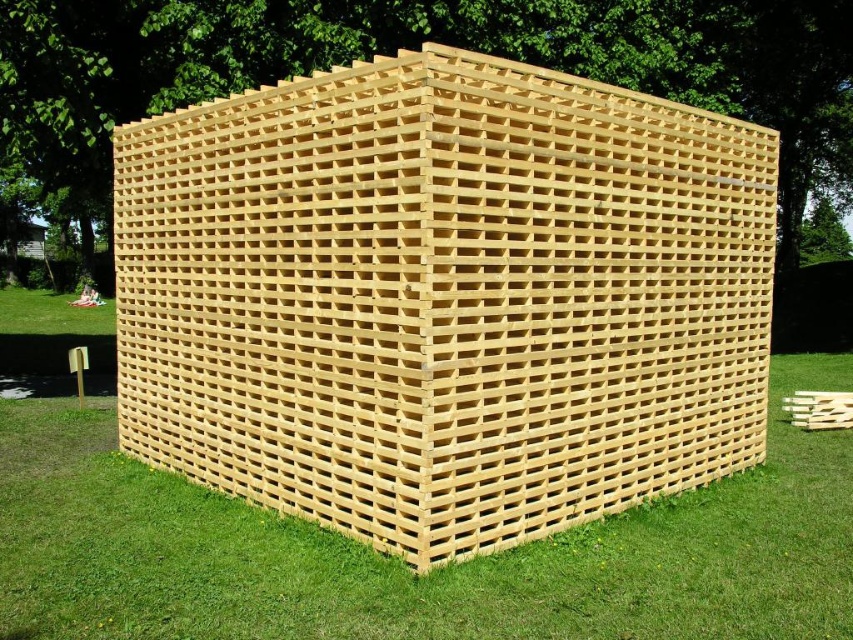
Between point (334, 397) and point (683, 586), which one is positioned in front?

Point (683, 586) is more forward.

The width and height of the screenshot is (853, 640). Describe the element at coordinates (444, 298) in the screenshot. I see `natural wood lattice structure at center` at that location.

Identify the location of natural wood lattice structure at center. (444, 298).

This screenshot has width=853, height=640. I want to click on natural wood lattice structure at center, so click(444, 298).